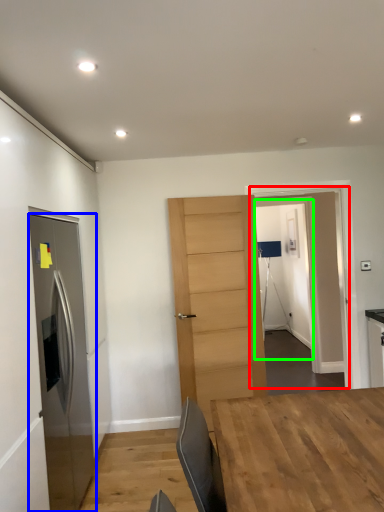
Question: Based on their relative distances, which object is nearer to glass door (highlighted by a red box)? Choose from door (highlighted by a blue box) and glass door (highlighted by a green box).

Choices:
 (A) door
 (B) glass door

Answer: (B)